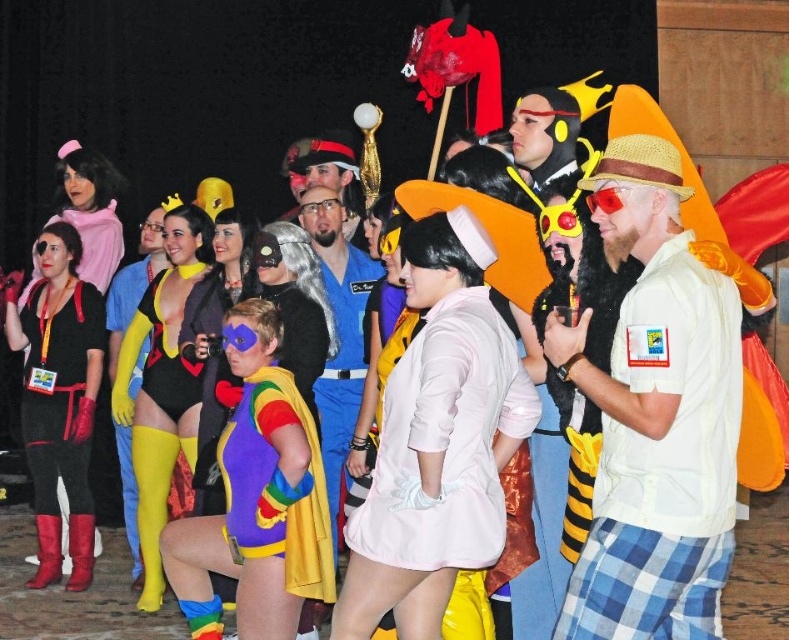
Between blue fabric shirt at center and yellow spandex suit at center, which one is positioned higher?

yellow spandex suit at center

Is blue fabric shirt at center above yellow spandex suit at center?

No.

Which is in front, point (350, 298) or point (129, 470)?

Point (350, 298) is in front.

Find the location of a particular element. This screenshot has width=789, height=640. blue fabric shirt at center is located at coordinates (338, 332).

Between blue fabric shirt at center and black spandex bodysuit at center, which one has more height?

Standing taller between the two is blue fabric shirt at center.

Is blue fabric shirt at center thinner than black spandex bodysuit at center?

In fact, blue fabric shirt at center might be wider than black spandex bodysuit at center.

Which is in front, point (335, 497) or point (206, 275)?

Point (335, 497) is more forward.

Locate an element on the screen. This screenshot has width=789, height=640. blue fabric shirt at center is located at coordinates (338, 332).

Can you confirm if pink satin dress at center is wider than blue fabric shirt at center?

Indeed, pink satin dress at center has a greater width compared to blue fabric shirt at center.

Who is more distant from viewer, [380,486] or [367,260]?

The point [367,260] is behind.

Where is `pink satin dress at center`? This screenshot has height=640, width=789. pink satin dress at center is located at coordinates (445, 440).